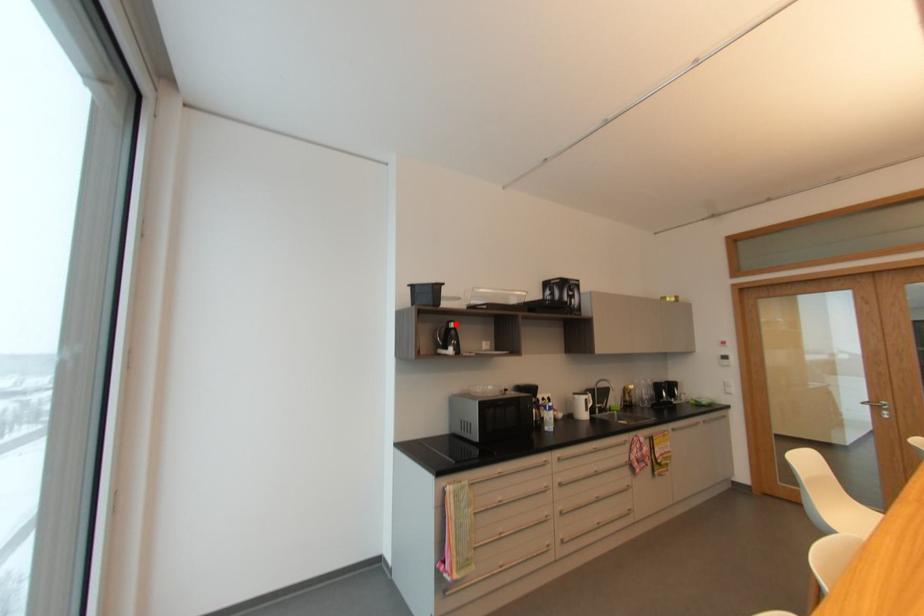
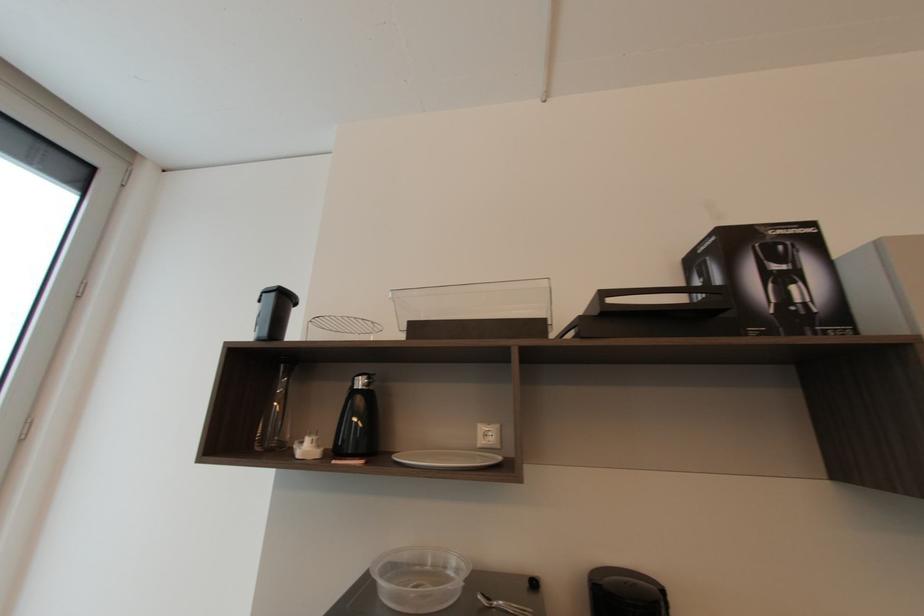
Locate, in the second image, the point that corresponds to the highlighted location in the first image.

(362, 384)